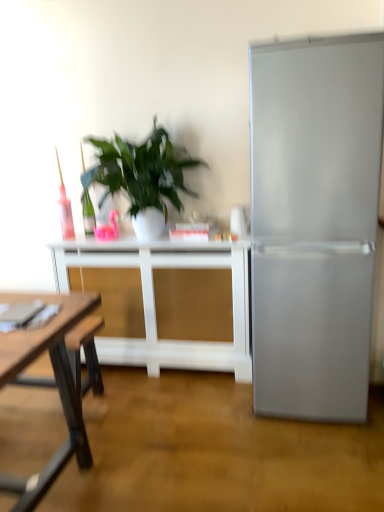
Question: Considering the positions of satin silver refrigerator at right and white matte table at center in the image, is satin silver refrigerator at right wider or thinner than white matte table at center?

Choices:
 (A) wide
 (B) thin

Answer: (A)

Question: Considering the positions of satin silver refrigerator at right and white matte table at center in the image, is satin silver refrigerator at right bigger or smaller than white matte table at center?

Choices:
 (A) small
 (B) big

Answer: (B)

Question: Considering the real-world distances, which object is farthest from the white matte table at center?

Choices:
 (A) satin silver refrigerator at right
 (B) green leafy plant at center

Answer: (A)

Question: Which is farther from the satin silver refrigerator at right?

Choices:
 (A) white matte table at center
 (B) green leafy plant at center

Answer: (B)